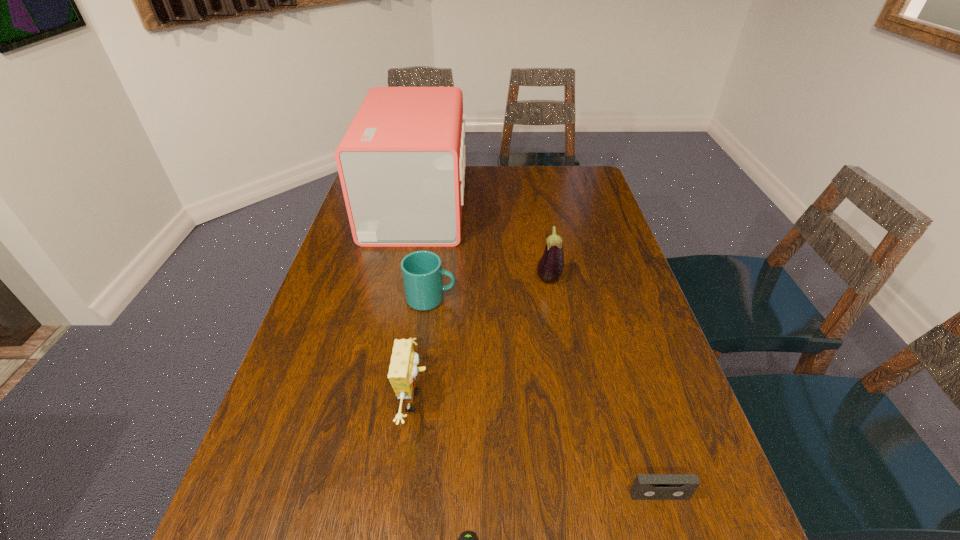
Where is `blank region between the cup and the second object from right to left`? The image size is (960, 540). blank region between the cup and the second object from right to left is located at coordinates (490, 289).

In order to click on vacant point located between the sponge and the fifth object from left to right in this screenshot , I will do `click(482, 341)`.

This screenshot has width=960, height=540. What are the coordinates of `vacant area that lies between the third tallest object and the fifth object from left to right` in the screenshot? It's located at (482, 341).

Where is `free space between the fifth tallest object and the box`? Image resolution: width=960 pixels, height=540 pixels. free space between the fifth tallest object and the box is located at coordinates point(538,350).

Locate an element on the screen. The width and height of the screenshot is (960, 540). free space between the fifth object from left to right and the third nearest object is located at coordinates (482, 341).

At what (x,y) coordinates should I click in order to perform the action: click on unoccupied position between the cup and the eggplant. Please return your answer as a coordinate pair (x, y). Looking at the image, I should click on (490, 289).

Identify which object is located as the nearest to the box. Please provide its 2D coordinates. Your answer should be formatted as a tuple, i.e. [(x, y)], where the tuple contains the x and y coordinates of a point satisfying the conditions above.

[(422, 272)]

At what (x,y) coordinates should I click in order to perform the action: click on object that stands as the fifth closest to the third nearest object. Please return your answer as a coordinate pair (x, y). Looking at the image, I should click on (401, 163).

Find the location of `vacant area that satisfies the following two spatial constraints: 1. on the surface of the tallest object where the text is embossed; 2. on the back side of the fifth object from left to right`. vacant area that satisfies the following two spatial constraints: 1. on the surface of the tallest object where the text is embossed; 2. on the back side of the fifth object from left to right is located at coordinates (401, 280).